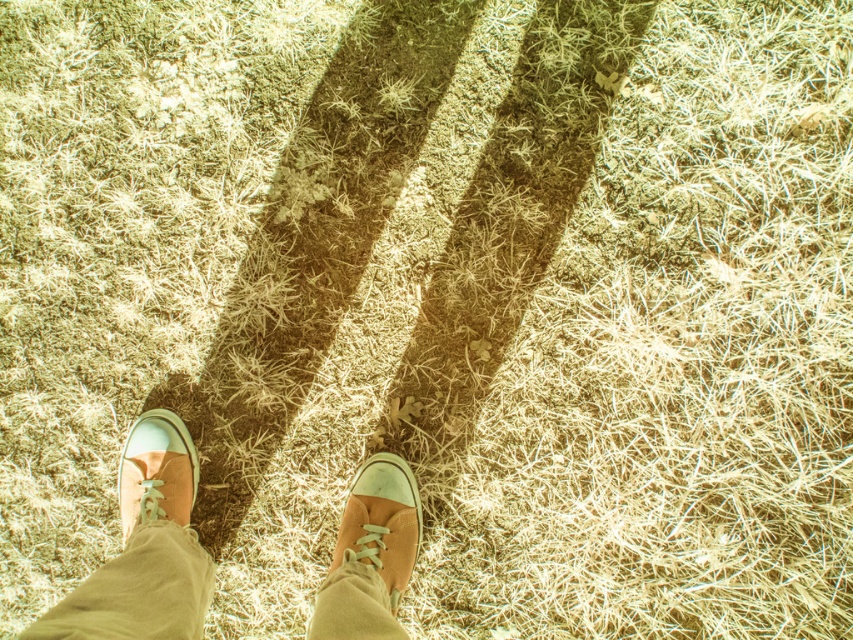
Who is more forward, (x=102, y=589) or (x=142, y=588)?

Point (x=102, y=589) is in front.

Who is lower down, tan canvas shoes at center or khaki pants at lower left?

khaki pants at lower left is lower down.

Which is behind, point (374, 468) or point (91, 616)?

Positioned behind is point (374, 468).

This screenshot has width=853, height=640. I want to click on tan canvas shoes at center, so click(x=144, y=547).

Which is more to the right, khaki pants at lower left or light brown suede shoe at lower left?

From the viewer's perspective, khaki pants at lower left appears more on the right side.

Is point (180, 616) closer to camera compared to point (134, 493)?

Yes, it is in front of point (134, 493).

What are the coordinates of `khaki pants at lower left` in the screenshot? It's located at (138, 589).

Is khaki pants at lower left thinner than matte canvas shoe at center?

In fact, khaki pants at lower left might be wider than matte canvas shoe at center.

Does point (206, 579) come behind point (372, 550)?

That is False.

Image resolution: width=853 pixels, height=640 pixels. Identify the location of khaki pants at lower left. (138, 589).